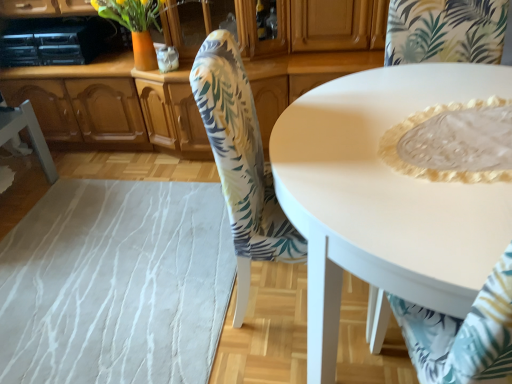
Question: From a real-world perspective, is white fabric chair at lower left, placed as the 3th chair when sorted from right to left, above or below white glossy table at center?

Choices:
 (A) below
 (B) above

Answer: (A)

Question: In the image, is white fabric chair at lower left, placed as the 3th chair when sorted from right to left, positioned in front of or behind white glossy table at center?

Choices:
 (A) front
 (B) behind

Answer: (B)

Question: Based on their relative distances, which object is nearer to the white glossy table at center?

Choices:
 (A) white lace tablecloth at lower right, the third chair in the left-to-right sequence
 (B) white fabric chair at lower left, which is the first chair in left-to-right order
 (C) floral fabric chair at center, the second chair viewed from the right
 (D) wooden cabinet at center

Answer: (C)

Question: Which of these objects is positioned farthest from the white lace tablecloth at lower right, which ranks as the first chair in right-to-left order?

Choices:
 (A) floral fabric chair at center, the second chair positioned from the left
 (B) white glossy table at center
 (C) wooden cabinet at center
 (D) white fabric chair at lower left, which is the first chair in left-to-right order

Answer: (D)